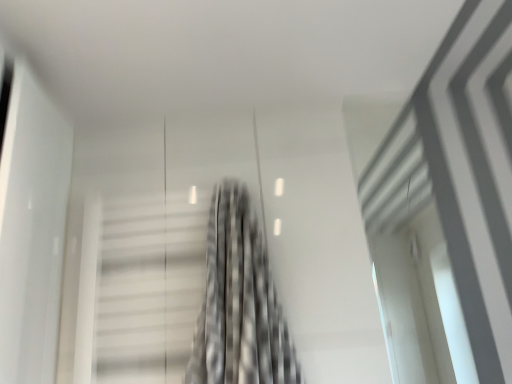
Question: Considering the relative sizes of metallic staircase at center and black textured curtain at center in the image provided, is metallic staircase at center shorter than black textured curtain at center?

Choices:
 (A) no
 (B) yes

Answer: (B)

Question: Does metallic staircase at center come behind black textured curtain at center?

Choices:
 (A) no
 (B) yes

Answer: (B)

Question: From a real-world perspective, is metallic staircase at center under black textured curtain at center?

Choices:
 (A) yes
 (B) no

Answer: (B)

Question: From the image's perspective, is metallic staircase at center under black textured curtain at center?

Choices:
 (A) yes
 (B) no

Answer: (A)

Question: Can you confirm if metallic staircase at center is wider than black textured curtain at center?

Choices:
 (A) no
 (B) yes

Answer: (A)

Question: Is metallic staircase at center in front of black textured curtain at center?

Choices:
 (A) no
 (B) yes

Answer: (A)

Question: From a real-world perspective, is black textured curtain at center below metallic staircase at center?

Choices:
 (A) yes
 (B) no

Answer: (A)

Question: Does black textured curtain at center have a smaller size compared to metallic staircase at center?

Choices:
 (A) yes
 (B) no

Answer: (B)

Question: Is black textured curtain at center oriented towards metallic staircase at center?

Choices:
 (A) yes
 (B) no

Answer: (B)

Question: Considering the relative sizes of black textured curtain at center and metallic staircase at center in the image provided, is black textured curtain at center wider than metallic staircase at center?

Choices:
 (A) yes
 (B) no

Answer: (A)

Question: Can you confirm if black textured curtain at center is shorter than metallic staircase at center?

Choices:
 (A) no
 (B) yes

Answer: (A)

Question: Can you confirm if black textured curtain at center is bigger than metallic staircase at center?

Choices:
 (A) no
 (B) yes

Answer: (B)

Question: Considering the positions of point (230, 241) and point (165, 316), is point (230, 241) closer or farther from the camera than point (165, 316)?

Choices:
 (A) farther
 (B) closer

Answer: (A)